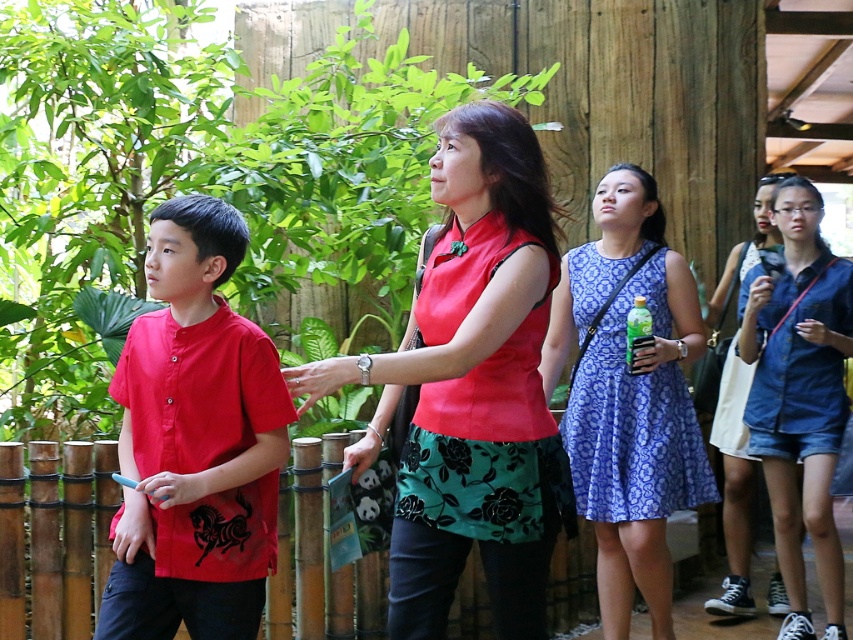
Question: Based on their relative distances, which object is nearer to the matte red shirt at left?

Choices:
 (A) blue floral dress at center
 (B) denim shorts at lower right
 (C) matte red blouse at center

Answer: (C)

Question: Estimate the real-world distances between objects in this image. Which object is closer to the matte red blouse at center?

Choices:
 (A) denim shorts at lower right
 (B) blue floral dress at center
 (C) matte red shirt at left

Answer: (C)

Question: Can you confirm if matte red blouse at center is positioned to the left of blue floral dress at center?

Choices:
 (A) no
 (B) yes

Answer: (B)

Question: Does matte red blouse at center lie in front of denim shorts at lower right?

Choices:
 (A) no
 (B) yes

Answer: (B)

Question: Is matte red blouse at center positioned before denim shorts at lower right?

Choices:
 (A) no
 (B) yes

Answer: (B)

Question: Which point is farther to the camera?

Choices:
 (A) (732, 444)
 (B) (575, 288)
 (C) (172, 392)

Answer: (A)